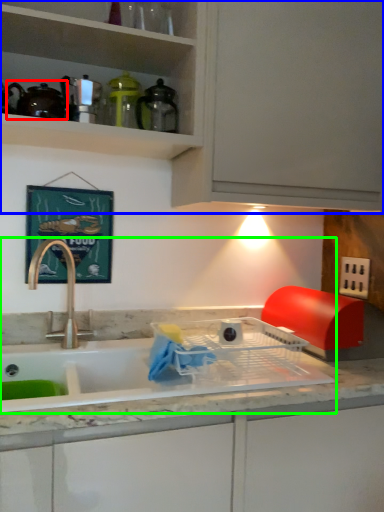
Question: Considering the real-world distances, which object is closest to tea pot (highlighted by a red box)? cabinetry (highlighted by a blue box) or sink (highlighted by a green box).

Choices:
 (A) cabinetry
 (B) sink

Answer: (A)